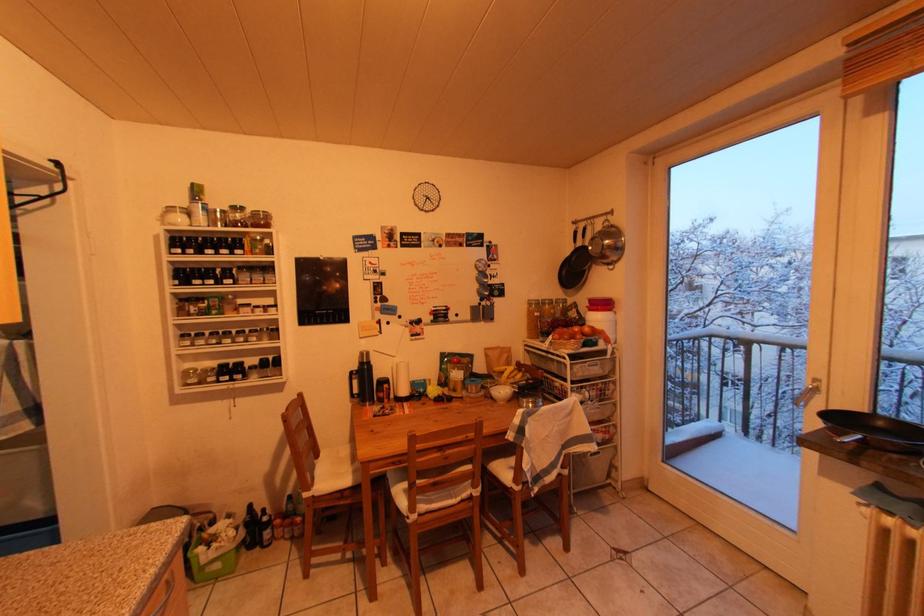
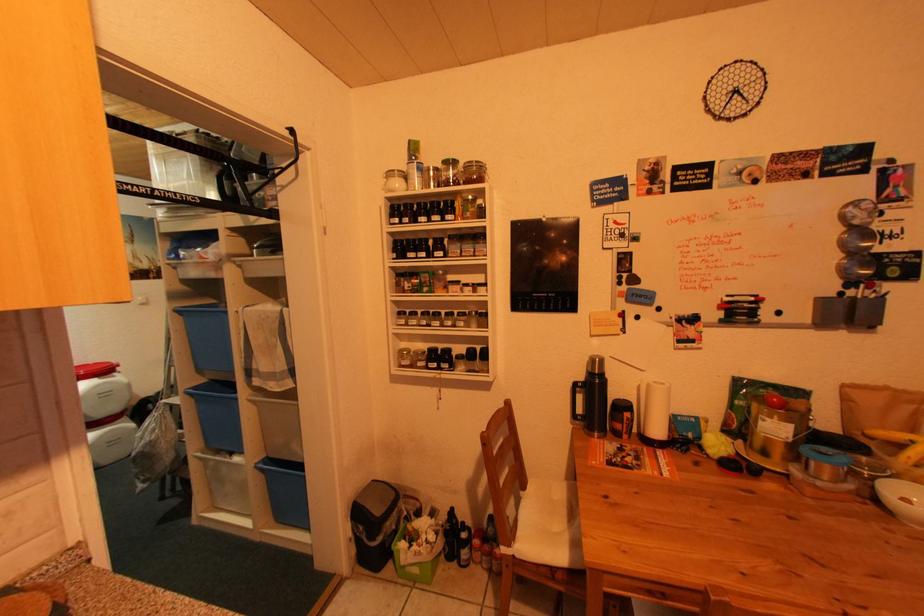
Question: The camera is either moving clockwise (left) or counter-clockwise (right) around the object. The first image is from the beginning of the video and the second image is from the end. Is the camera moving left or right when shooting the video?

Choices:
 (A) Left
 (B) Right

Answer: (B)